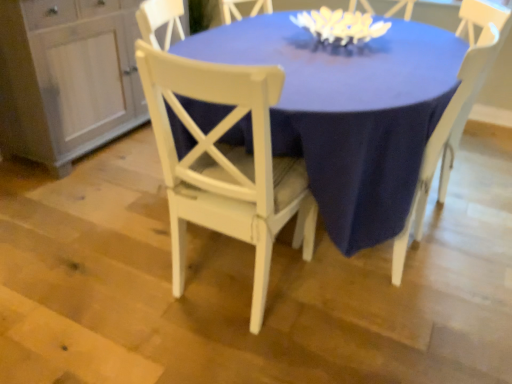
The height and width of the screenshot is (384, 512). What do you see at coordinates (452, 124) in the screenshot?
I see `white wood chair at center, the 1th chair when ordered from right to left` at bounding box center [452, 124].

The image size is (512, 384). Identify the location of white wood chair at center, the second chair when ordered from right to left. (226, 163).

Can you confirm if white wood chair at center, the 1th chair when ordered from right to left, is positioned to the right of white matte floral arrangement at upper center?

Indeed, white wood chair at center, the 1th chair when ordered from right to left, is positioned on the right side of white matte floral arrangement at upper center.

Can you tell me how much white wood chair at center, the 1th chair when ordered from right to left, and white matte floral arrangement at upper center differ in facing direction?

The facing directions of white wood chair at center, the 1th chair when ordered from right to left, and white matte floral arrangement at upper center are 69.2 degrees apart.

Between white wood chair at center, which ranks as the 2th chair in left-to-right order, and white matte floral arrangement at upper center, which one has larger size?

white wood chair at center, which ranks as the 2th chair in left-to-right order.

Considering the positions of points (438, 137) and (31, 47), is point (438, 137) farther from camera compared to point (31, 47)?

No, it is not.

Who is shorter, white wood chair at center, which ranks as the 2th chair in left-to-right order, or white wood dresser at left?

white wood dresser at left.

What's the angular difference between white wood chair at center, which ranks as the 2th chair in left-to-right order, and white wood dresser at left's facing directions?

160 degrees.

Where is `dresser above the white wood chair at center, the 1th chair when ordered from right to left (from the image's perspective)`? The image size is (512, 384). dresser above the white wood chair at center, the 1th chair when ordered from right to left (from the image's perspective) is located at coordinates (67, 77).

Which is more to the right, white wood chair at center, positioned as the 1th chair in left-to-right order, or white wood chair at center, which ranks as the 2th chair in left-to-right order?

white wood chair at center, which ranks as the 2th chair in left-to-right order.

Looking at this image, which is in front, white wood chair at center, the second chair when ordered from right to left, or white wood chair at center, the 1th chair when ordered from right to left?

white wood chair at center, the second chair when ordered from right to left, is more forward.

Is point (354, 75) positioned in front of point (416, 186)?

No, (354, 75) is behind (416, 186).

Would you say matte white table at center is inside or outside white wood chair at center, which ranks as the 2th chair in left-to-right order?

matte white table at center exists outside the volume of white wood chair at center, which ranks as the 2th chair in left-to-right order.

Is matte white table at center facing towards white wood chair at center, which ranks as the 2th chair in left-to-right order?

No, matte white table at center is not aimed at white wood chair at center, which ranks as the 2th chair in left-to-right order.

In terms of size, does matte white table at center appear bigger or smaller than white wood chair at center, the 1th chair when ordered from right to left?

Considering their sizes, matte white table at center takes up more space than white wood chair at center, the 1th chair when ordered from right to left.

Considering the sizes of white wood chair at center, which ranks as the 2th chair in left-to-right order, and white wood chair at center, positioned as the 1th chair in left-to-right order, in the image, is white wood chair at center, which ranks as the 2th chair in left-to-right order, taller or shorter than white wood chair at center, positioned as the 1th chair in left-to-right order,?

Clearly, white wood chair at center, which ranks as the 2th chair in left-to-right order, is taller compared to white wood chair at center, positioned as the 1th chair in left-to-right order.

Is the surface of white wood chair at center, the 1th chair when ordered from right to left, in direct contact with white wood chair at center, the second chair when ordered from right to left?

white wood chair at center, the 1th chair when ordered from right to left, and white wood chair at center, the second chair when ordered from right to left, are not in contact.

How many degrees apart are the facing directions of white wood chair at center, which ranks as the 2th chair in left-to-right order, and white wood chair at center, the second chair when ordered from right to left?

The facing directions of white wood chair at center, which ranks as the 2th chair in left-to-right order, and white wood chair at center, the second chair when ordered from right to left, are 106 degrees apart.

In the scene shown: Is white wood chair at center, which ranks as the 2th chair in left-to-right order, bigger than white wood chair at center, positioned as the 1th chair in left-to-right order?

No.

From a real-world perspective, is white wood chair at center, the second chair when ordered from right to left, on top of matte white table at center?

Yes, from a real-world perspective, white wood chair at center, the second chair when ordered from right to left, is over matte white table at center

From the image's perspective, is white wood chair at center, the second chair when ordered from right to left, beneath matte white table at center?

Yes.

Is point (283, 78) farther from viewer compared to point (297, 147)?

No, (283, 78) is in front of (297, 147).

Is white wood chair at center, positioned as the 1th chair in left-to-right order, next to matte white table at center and touching it?

white wood chair at center, positioned as the 1th chair in left-to-right order, and matte white table at center are clearly separated.

Which is in front, white wood chair at center, positioned as the 1th chair in left-to-right order, or white matte floral arrangement at upper center?

white wood chair at center, positioned as the 1th chair in left-to-right order, is more forward.

From a real-world perspective, is white wood chair at center, the second chair when ordered from right to left, physically below white matte floral arrangement at upper center?

Yes, from a real-world perspective, white wood chair at center, the second chair when ordered from right to left, is under white matte floral arrangement at upper center.

Considering the points (178, 243) and (305, 20), which point is behind, point (178, 243) or point (305, 20)?

Point (305, 20)

Identify the location of floral arrangement in front of the white wood chair at center, which ranks as the 2th chair in left-to-right order. click(341, 26).

You are a GUI agent. You are given a task and a screenshot of the screen. Output one action in this format:
    pyautogui.click(x=<x>, y=<y>)
    Task: Click on the dresser behind the white wood chair at center, the 1th chair when ordered from right to left
    
    Given the screenshot: What is the action you would take?
    [x=67, y=77]

Looking at the image, which one is located further to white wood chair at center, which ranks as the 2th chair in left-to-right order, white wood dresser at left or white matte floral arrangement at upper center?

white wood dresser at left is positioned further to the anchor white wood chair at center, which ranks as the 2th chair in left-to-right order.

Which object lies further to the anchor point white wood chair at center, which ranks as the 2th chair in left-to-right order, white wood dresser at left or matte white table at center?

white wood dresser at left is further to white wood chair at center, which ranks as the 2th chair in left-to-right order.

Which object lies nearer to the anchor point white wood chair at center, positioned as the 1th chair in left-to-right order, white wood dresser at left or white wood chair at center, which ranks as the 2th chair in left-to-right order?

Among the two, white wood chair at center, which ranks as the 2th chair in left-to-right order, is located nearer to white wood chair at center, positioned as the 1th chair in left-to-right order.

Looking at the image, which one is located closer to matte white table at center, white wood chair at center, the second chair when ordered from right to left, or white matte floral arrangement at upper center?

white wood chair at center, the second chair when ordered from right to left, lies closer to matte white table at center than the other object.

Which object lies nearer to the anchor point white wood chair at center, which ranks as the 2th chair in left-to-right order, white matte floral arrangement at upper center or white wood dresser at left?

Among the two, white matte floral arrangement at upper center is located nearer to white wood chair at center, which ranks as the 2th chair in left-to-right order.

Based on their spatial positions, is white wood dresser at left or matte white table at center further from white wood chair at center, positioned as the 1th chair in left-to-right order?

white wood dresser at left.

Based on their spatial positions, is white wood chair at center, positioned as the 1th chair in left-to-right order, or matte white table at center further from white wood dresser at left?

white wood chair at center, positioned as the 1th chair in left-to-right order, lies further to white wood dresser at left than the other object.

Based on their spatial positions, is white wood dresser at left or white wood chair at center, positioned as the 1th chair in left-to-right order, further from white wood chair at center, the 1th chair when ordered from right to left?

white wood dresser at left is positioned further to the anchor white wood chair at center, the 1th chair when ordered from right to left.

Image resolution: width=512 pixels, height=384 pixels. Identify the location of floral arrangement located between matte white table at center and white wood chair at center, the 1th chair when ordered from right to left, in the depth direction. (341, 26).

The height and width of the screenshot is (384, 512). I want to click on floral arrangement between white wood dresser at left and white wood chair at center, which ranks as the 2th chair in left-to-right order, so click(341, 26).

This screenshot has height=384, width=512. I want to click on chair located between white wood dresser at left and matte white table at center in the left-right direction, so click(226, 163).

Locate an element on the screen. floral arrangement located between white wood chair at center, positioned as the 1th chair in left-to-right order, and white wood chair at center, the 1th chair when ordered from right to left, in the left-right direction is located at coordinates (341, 26).